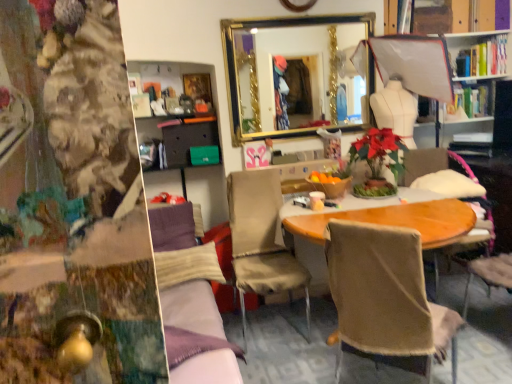
Question: Looking at the image, does beige fabric chair at center, which is the third chair in right-to-left order, seem bigger or smaller compared to wooden chair at center, marked as the 1th chair in a right-to-left arrangement?

Choices:
 (A) small
 (B) big

Answer: (A)

Question: Considering the positions of point coord(254,226) and point coord(425,155), is point coord(254,226) closer or farther from the camera than point coord(425,155)?

Choices:
 (A) closer
 (B) farther

Answer: (A)

Question: Considering the real-world distances, which object is farthest from the beige fabric chair at center, which is the third chair in right-to-left order?

Choices:
 (A) wooden chair at center, acting as the 3th chair starting from the left
 (B) velvet purple couch at center
 (C) beige fabric chair at center, placed as the 2th chair when sorted from right to left
 (D) gold-framed mirror at upper center
 (E) matte gray drawer at center-left

Answer: (A)

Question: Based on their relative distances, which object is farther from the matte gray drawer at center-left?

Choices:
 (A) velvet purple couch at center
 (B) wooden chair at center, acting as the 3th chair starting from the left
 (C) beige fabric chair at center, which is the third chair in right-to-left order
 (D) beige fabric chair at center, placed as the 2th chair when sorted from right to left
 (E) hardcover books at upper right

Answer: (E)